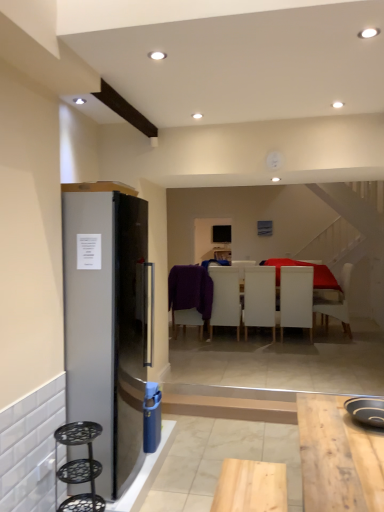
Question: From their relative heights in the image, would you say purple fabric chair at center, which ranks as the 5th chair in right-to-left order, is taller or shorter than white matte chair at center, the fifth chair positioned from the left?

Choices:
 (A) tall
 (B) short

Answer: (B)

Question: Is point (185, 266) positioned closer to the camera than point (322, 317)?

Choices:
 (A) closer
 (B) farther

Answer: (B)

Question: Considering the real-world distances, which object is closest to the black non-stick pan at lower right?

Choices:
 (A) black metal bar stool at left
 (B) white matte chair at center, which is counted as the 1th chair, starting from the right
 (C) white matte chair at center, which ranks as the 2th chair in left-to-right order
 (D) white matte chair at center, the third chair viewed from the right
 (E) purple fabric chair at center, which is the first chair in left-to-right order

Answer: (A)

Question: Which object is positioned closest to the white matte chair at center, which appears as the fourth chair when viewed from the left?

Choices:
 (A) white matte chair at center, which is counted as the 1th chair, starting from the right
 (B) black non-stick pan at lower right
 (C) black metal bar stool at left
 (D) purple fabric chair at center, which is the first chair in left-to-right order
 (E) white matte chair at center, which is counted as the fourth chair, starting from the right

Answer: (A)